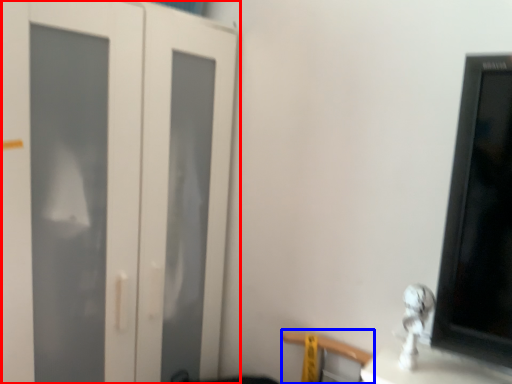
Question: Which object appears farthest to the camera in this image, door (highlighted by a red box) or chair (highlighted by a blue box)?

Choices:
 (A) door
 (B) chair

Answer: (B)